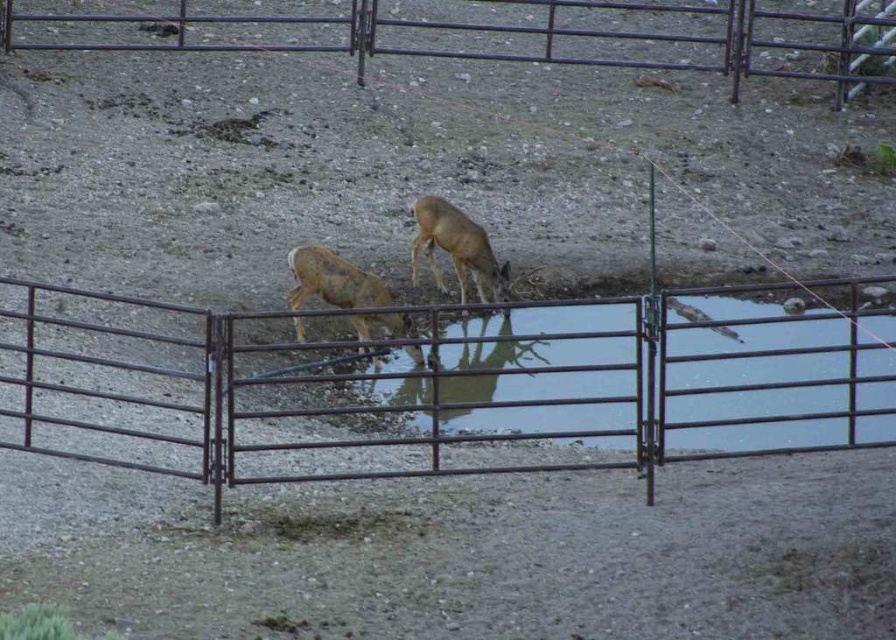
Question: Is brushed metal fence at upper center thinner than golden fur deer at center?

Choices:
 (A) no
 (B) yes

Answer: (A)

Question: Estimate the real-world distances between objects in this image. Which object is closer to the golden fur deer at center?

Choices:
 (A) rusty metal gate at center
 (B) brushed metal fence at upper center

Answer: (A)

Question: Is brown matte/deer at center positioned at the back of golden fur deer at center?

Choices:
 (A) no
 (B) yes

Answer: (A)

Question: Is rusty metal gate at center closer to camera compared to brushed metal fence at upper center?

Choices:
 (A) no
 (B) yes

Answer: (B)

Question: Which of the following is the closest to the observer?

Choices:
 (A) (661, 449)
 (B) (480, 289)
 (C) (228, 33)
 (D) (369, 301)

Answer: (A)

Question: Which point is farther to the camera?

Choices:
 (A) (484, 356)
 (B) (46, 12)
 (C) (462, 211)
 (D) (369, 304)

Answer: (B)